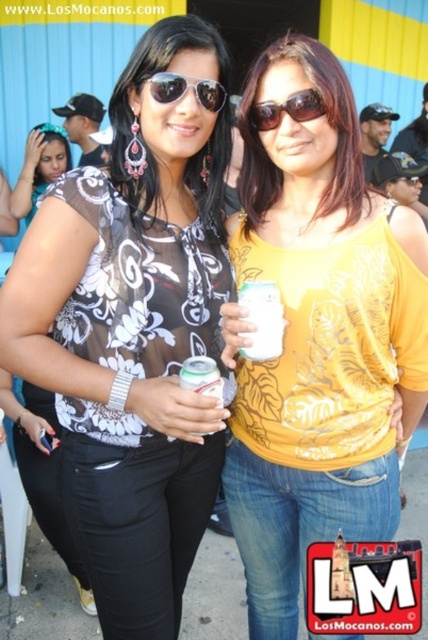
Locate an element on the screen. The width and height of the screenshot is (428, 640). yellow printed shirt at center is located at coordinates (318, 337).

Does yellow printed shirt at center lie behind matte black top at center?

No, yellow printed shirt at center is closer to the viewer.

Which is behind, point (353, 124) or point (14, 214)?

The point (14, 214) is more distant.

Find the location of `yellow printed shirt at center`. yellow printed shirt at center is located at coordinates (318, 337).

Who is more forward, (315, 356) or (294, 104)?

Point (294, 104)

Who is more distant from viewer, (282,164) or (321,115)?

The point (282,164) is behind.

Where is `yellow printed shirt at center`? The height and width of the screenshot is (640, 428). yellow printed shirt at center is located at coordinates (x=318, y=337).

Does matte floral blouse at center have a lesser width compared to matte black sunglasses at center?

No.

Does matte floral blouse at center appear over matte black sunglasses at center?

No, matte floral blouse at center is not above matte black sunglasses at center.

Is point (109, 272) farther from viewer compared to point (174, 97)?

Yes, point (109, 272) is farther from viewer.

Where is `matte floral blouse at center`? The height and width of the screenshot is (640, 428). matte floral blouse at center is located at coordinates (133, 332).